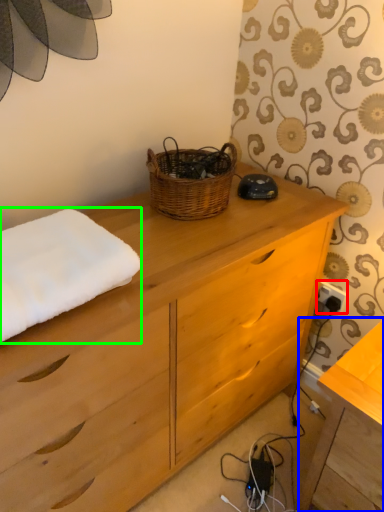
Question: Considering the real-world distances, which object is farthest from electric outlet (highlighted by a red box)? table (highlighted by a blue box) or bath towel (highlighted by a green box)?

Choices:
 (A) table
 (B) bath towel

Answer: (B)